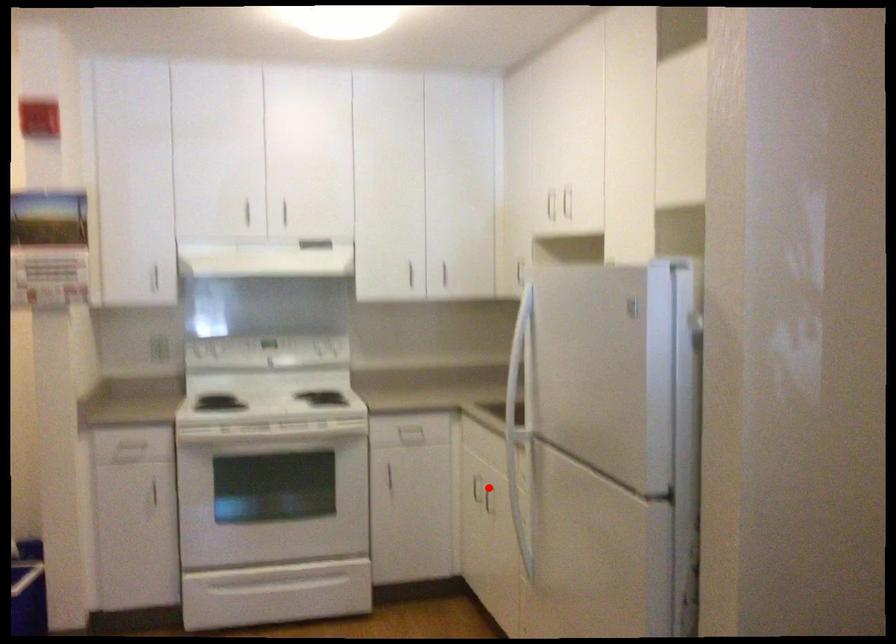
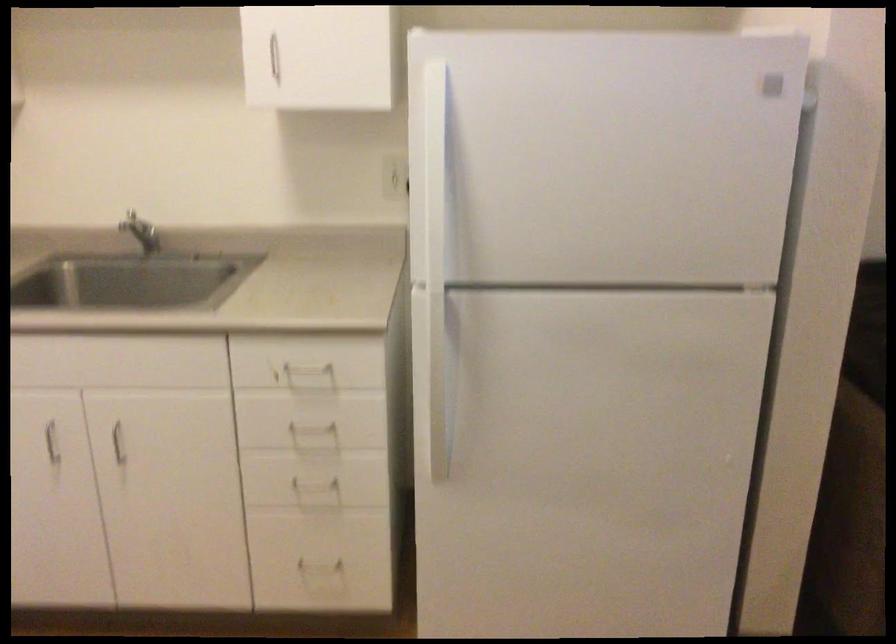
The point at the highlighted location is marked in the first image. Where is the corresponding point in the second image?

(116, 430)